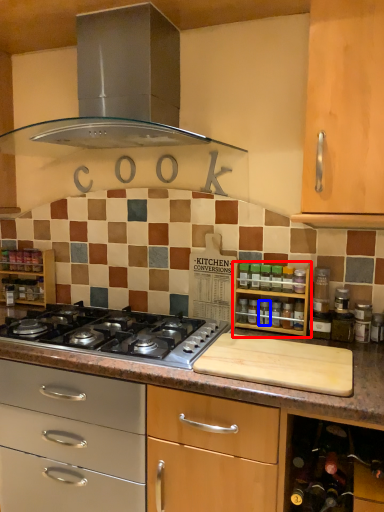
Question: Which object appears closest to the camera in this image, shelf (highlighted by a red box) or appliance (highlighted by a blue box)?

Choices:
 (A) shelf
 (B) appliance

Answer: (A)